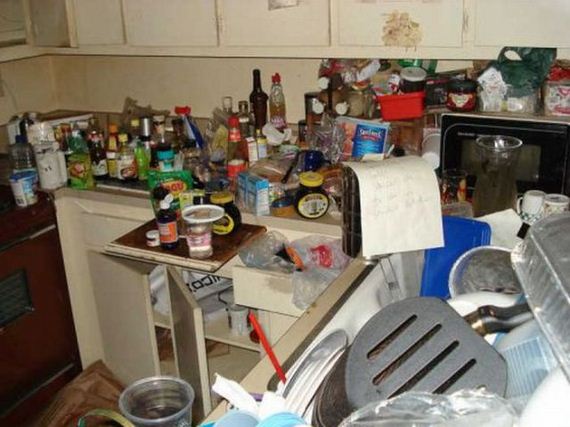
The image size is (570, 427). I want to click on tall glass bottle, so click(x=260, y=101).